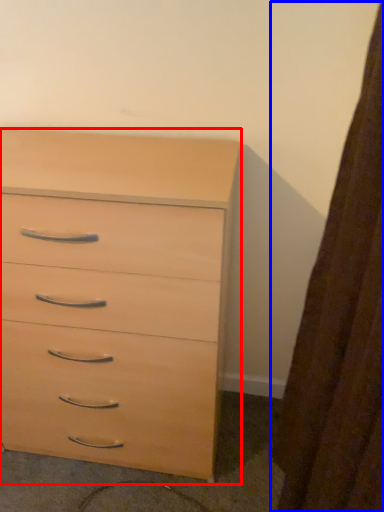
Question: Which object appears closest to the camera in this image, chest of drawers (highlighted by a red box) or curtain (highlighted by a blue box)?

Choices:
 (A) chest of drawers
 (B) curtain

Answer: (B)